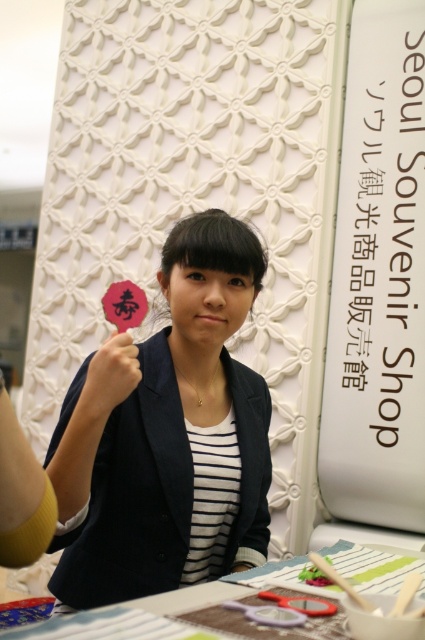
Is matte black blazer at center smaller than matte black hand at upper left?

No.

What are the coordinates of `matte black blazer at center` in the screenshot? It's located at (167, 435).

Identify the location of matte black blazer at center. (167, 435).

Can you confirm if matte black blazer at center is smaller than wooden table at lower center?

No, matte black blazer at center is not smaller than wooden table at lower center.

Is matte black blazer at center below wooden table at lower center?

No, matte black blazer at center is not below wooden table at lower center.

Is point (85, 557) behind point (393, 557)?

That is True.

You are a GUI agent. You are given a task and a screenshot of the screen. Output one action in this format:
    pyautogui.click(x=<x>, y=<y>)
    Task: Click on the matte black blazer at center
    
    Given the screenshot: What is the action you would take?
    pyautogui.click(x=167, y=435)

Does wooden table at lower center appear on the right side of matte black hand at upper left?

Indeed, wooden table at lower center is positioned on the right side of matte black hand at upper left.

You are a GUI agent. You are given a task and a screenshot of the screen. Output one action in this format:
    pyautogui.click(x=<x>, y=<y>)
    Task: Click on the wooden table at lower center
    Image resolution: width=425 pixels, height=640 pixels.
    Given the screenshot: What is the action you would take?
    pyautogui.click(x=192, y=614)

In order to click on wooden table at lower center in this screenshot , I will do `click(192, 614)`.